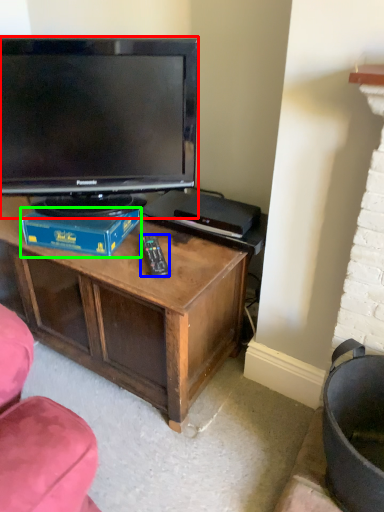
Question: Which object is the farthest from television (highlighted by a red box)? Choose among these: remote (highlighted by a blue box) or book (highlighted by a green box).

Choices:
 (A) remote
 (B) book

Answer: (A)